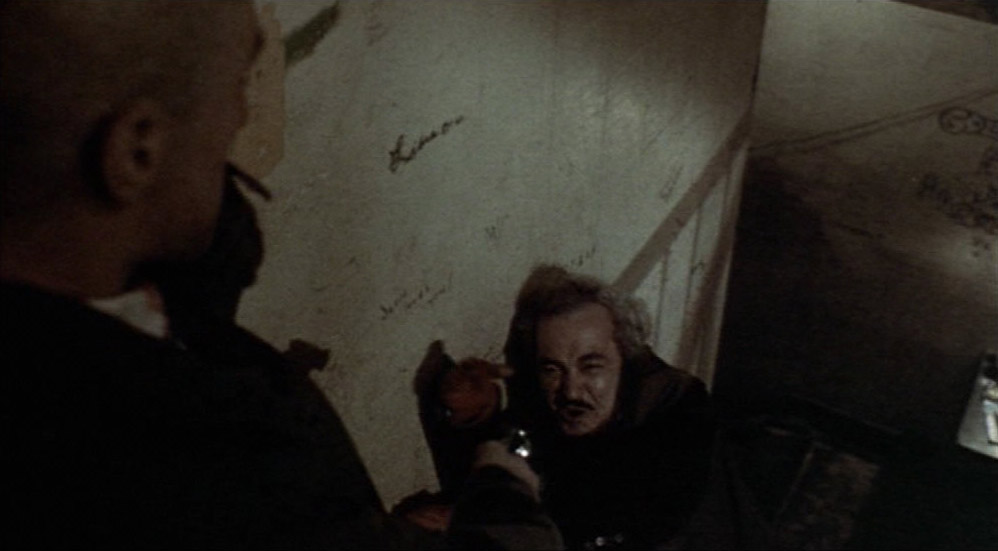
Image resolution: width=998 pixels, height=551 pixels. I want to click on floor, so click(x=838, y=478).